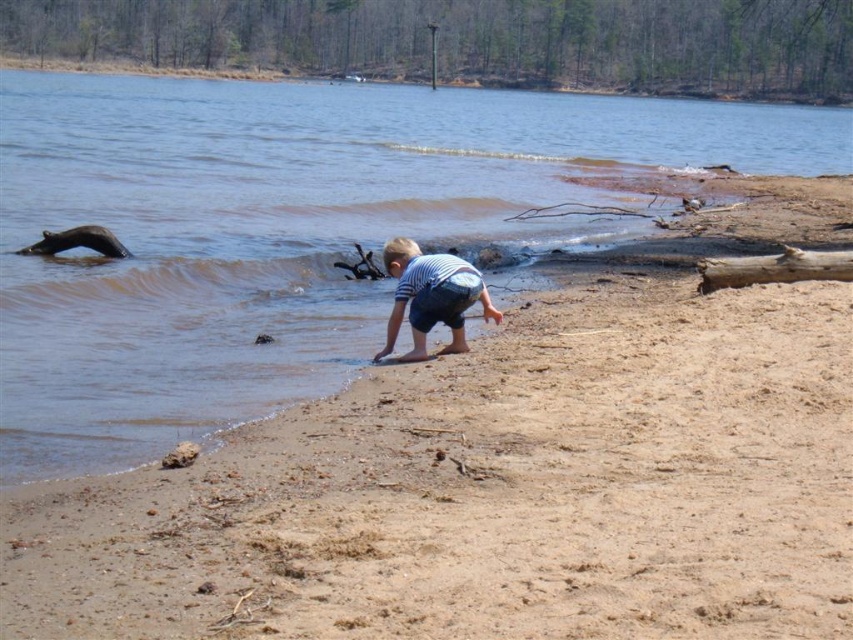
You are standing at the point marked by the coordinates point (508, 476). Looking around, you notice the brown sandy beach at lower center. Which direction should you walk to reach the water?

The brown sandy beach at lower center is located at point (508, 476). Since the shoreline is at the water edge, you should walk towards the water from the beach in the direction of the lower center point.

You are a parent watching your child play near the water. You need to place a small toy on the brown sandy beach at lower center so it won t get washed away by the waves. Should you place it closer to the brown rough wood log at right or further away from it?

The brown sandy beach at lower center is higher than the brown rough wood log at right. To prevent the toy from being washed away, place it further away from the log, on the higher part of the beach.

You are a photographer aiming to capture the striped cotton shirt at lower center and the brown sandy beach at lower center in a single shot. Based on their positions, which object should you adjust your camera to focus on first to ensure both are in frame?

The striped cotton shirt at lower center is on the left side of the brown sandy beach at lower center, so you should focus on the striped cotton shirt at lower center first to ensure both are in frame.